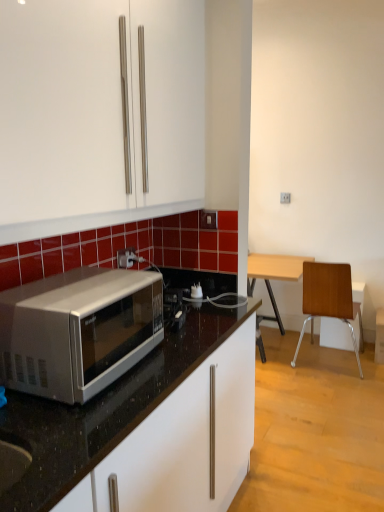
Question: Looking at their shapes, would you say silver metallic microwave at left is wider or thinner than white plastic power outlet at center?

Choices:
 (A) thin
 (B) wide

Answer: (B)

Question: Considering the positions of point (233, 397) and point (125, 256), is point (233, 397) closer or farther from the camera than point (125, 256)?

Choices:
 (A) farther
 (B) closer

Answer: (B)

Question: Which object is the farthest from the white plastic power outlet at center?

Choices:
 (A) silver metallic microwave at left
 (B) silver metallic microwave at left
 (C) wooden/metallic chair at right

Answer: (C)

Question: Estimate the real-world distances between objects in this image. Which object is farther from the wooden/metallic chair at right?

Choices:
 (A) silver metallic microwave at left
 (B) silver metallic microwave at left
 (C) white plastic power outlet at center

Answer: (B)